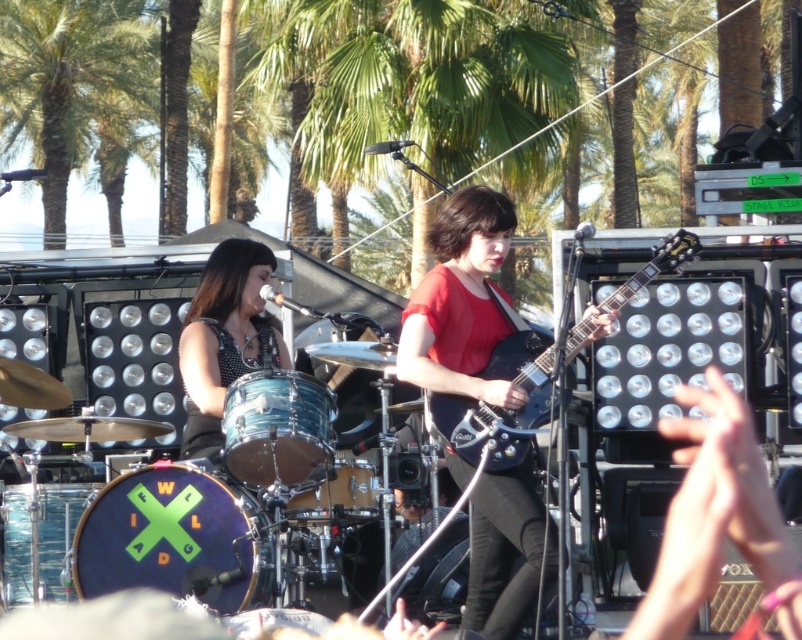
You are a stagehand checking the drum arrangement during a live performance. You notice the blue metallic drum at center and the wooden drum at center. Which drum is located to the left of the other?

The blue metallic drum at center is positioned on the left side of wooden drum at center.